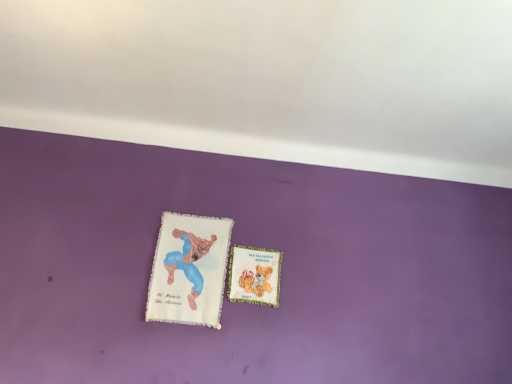
Identify the location of white fabric book at center, the second paperback book viewed from the right. The width and height of the screenshot is (512, 384). (189, 270).

The image size is (512, 384). Describe the element at coordinates (189, 270) in the screenshot. I see `white fabric book at center, the 1th paperback book in the left-to-right sequence` at that location.

This screenshot has width=512, height=384. What do you see at coordinates (254, 275) in the screenshot?
I see `pastel green fabric bookmark at center, marked as the 1th paperback book in a right-to-left arrangement` at bounding box center [254, 275].

Locate an element on the screen. pastel green fabric bookmark at center, marked as the 1th paperback book in a right-to-left arrangement is located at coordinates (254, 275).

In order to face pastel green fabric bookmark at center, marked as the 1th paperback book in a right-to-left arrangement, should I rotate leftwards or rightwards?

Turn right approximately 0.350 degrees to face it.

This screenshot has height=384, width=512. In order to click on white fabric book at center, the 1th paperback book in the left-to-right sequence in this screenshot , I will do `click(189, 270)`.

Would you say pastel green fabric bookmark at center, which is counted as the 2th paperback book, starting from the left, is to the left or to the right of white fabric book at center, the 1th paperback book in the left-to-right sequence, in the picture?

From the image, it's evident that pastel green fabric bookmark at center, which is counted as the 2th paperback book, starting from the left, is to the right of white fabric book at center, the 1th paperback book in the left-to-right sequence.

Is pastel green fabric bookmark at center, which is counted as the 2th paperback book, starting from the left, further to camera compared to white fabric book at center, the second paperback book viewed from the right?

Yes.

Is point (262, 281) more distant than point (216, 301)?

Yes, it is behind point (216, 301).

From the image's perspective, is pastel green fabric bookmark at center, marked as the 1th paperback book in a right-to-left arrangement, located above or below white fabric book at center, the second paperback book viewed from the right?

From the image's perspective, pastel green fabric bookmark at center, marked as the 1th paperback book in a right-to-left arrangement, appears below white fabric book at center, the second paperback book viewed from the right.

From a real-world perspective, is pastel green fabric bookmark at center, marked as the 1th paperback book in a right-to-left arrangement, physically below white fabric book at center, the 1th paperback book in the left-to-right sequence?

No, from a real-world perspective, pastel green fabric bookmark at center, marked as the 1th paperback book in a right-to-left arrangement, is not under white fabric book at center, the 1th paperback book in the left-to-right sequence.

Considering the relative sizes of pastel green fabric bookmark at center, marked as the 1th paperback book in a right-to-left arrangement, and white fabric book at center, the second paperback book viewed from the right, in the image provided, is pastel green fabric bookmark at center, marked as the 1th paperback book in a right-to-left arrangement, wider than white fabric book at center, the second paperback book viewed from the right,?

No.

Consider the image. Between pastel green fabric bookmark at center, which is counted as the 2th paperback book, starting from the left, and white fabric book at center, the second paperback book viewed from the right, which one has less height?

With less height is pastel green fabric bookmark at center, which is counted as the 2th paperback book, starting from the left.

Can you confirm if pastel green fabric bookmark at center, marked as the 1th paperback book in a right-to-left arrangement, is bigger than white fabric book at center, the 1th paperback book in the left-to-right sequence?

No, pastel green fabric bookmark at center, marked as the 1th paperback book in a right-to-left arrangement, is not bigger than white fabric book at center, the 1th paperback book in the left-to-right sequence.

Is pastel green fabric bookmark at center, which is counted as the 2th paperback book, starting from the left, situated inside white fabric book at center, the second paperback book viewed from the right, or outside?

pastel green fabric bookmark at center, which is counted as the 2th paperback book, starting from the left, is spatially situated outside white fabric book at center, the second paperback book viewed from the right.

Is pastel green fabric bookmark at center, which is counted as the 2th paperback book, starting from the left, not close to white fabric book at center, the 1th paperback book in the left-to-right sequence?

No, pastel green fabric bookmark at center, which is counted as the 2th paperback book, starting from the left, is not far away from white fabric book at center, the 1th paperback book in the left-to-right sequence.

From the picture: Is pastel green fabric bookmark at center, which is counted as the 2th paperback book, starting from the left, facing towards white fabric book at center, the second paperback book viewed from the right?

No, pastel green fabric bookmark at center, which is counted as the 2th paperback book, starting from the left, does not turn towards white fabric book at center, the second paperback book viewed from the right.

How many degrees apart are the facing directions of pastel green fabric bookmark at center, marked as the 1th paperback book in a right-to-left arrangement, and white fabric book at center, the 1th paperback book in the left-to-right sequence?

They differ by 0.191 degrees in their facing directions.

Could you measure the distance between pastel green fabric bookmark at center, which is counted as the 2th paperback book, starting from the left, and white fabric book at center, the second paperback book viewed from the right?

pastel green fabric bookmark at center, which is counted as the 2th paperback book, starting from the left, and white fabric book at center, the second paperback book viewed from the right, are 7.82 inches apart.

Identify the location of paperback book above the pastel green fabric bookmark at center, marked as the 1th paperback book in a right-to-left arrangement (from the image's perspective). (189, 270).

Between white fabric book at center, the 1th paperback book in the left-to-right sequence, and pastel green fabric bookmark at center, which is counted as the 2th paperback book, starting from the left, which one appears on the left side from the viewer's perspective?

white fabric book at center, the 1th paperback book in the left-to-right sequence, is more to the left.

Relative to pastel green fabric bookmark at center, marked as the 1th paperback book in a right-to-left arrangement, is white fabric book at center, the second paperback book viewed from the right, in front or behind?

white fabric book at center, the second paperback book viewed from the right, is in front of pastel green fabric bookmark at center, marked as the 1th paperback book in a right-to-left arrangement.

Considering the points (182, 217) and (236, 251), which point is behind, point (182, 217) or point (236, 251)?

The point (182, 217) is farther.

From the image's perspective, which one is positioned higher, white fabric book at center, the 1th paperback book in the left-to-right sequence, or pastel green fabric bookmark at center, marked as the 1th paperback book in a right-to-left arrangement?

white fabric book at center, the 1th paperback book in the left-to-right sequence, appears higher in the image.

From a real-world perspective, is white fabric book at center, the 1th paperback book in the left-to-right sequence, positioned over pastel green fabric bookmark at center, marked as the 1th paperback book in a right-to-left arrangement, based on gravity?

Incorrect, from a real-world perspective, white fabric book at center, the 1th paperback book in the left-to-right sequence, is lower than pastel green fabric bookmark at center, marked as the 1th paperback book in a right-to-left arrangement.

Considering the relative sizes of white fabric book at center, the 1th paperback book in the left-to-right sequence, and pastel green fabric bookmark at center, marked as the 1th paperback book in a right-to-left arrangement, in the image provided, is white fabric book at center, the 1th paperback book in the left-to-right sequence, thinner than pastel green fabric bookmark at center, marked as the 1th paperback book in a right-to-left arrangement,?

No, white fabric book at center, the 1th paperback book in the left-to-right sequence, is not thinner than pastel green fabric bookmark at center, marked as the 1th paperback book in a right-to-left arrangement.

Does white fabric book at center, the second paperback book viewed from the right, have a lesser height compared to pastel green fabric bookmark at center, marked as the 1th paperback book in a right-to-left arrangement?

In fact, white fabric book at center, the second paperback book viewed from the right, may be taller than pastel green fabric bookmark at center, marked as the 1th paperback book in a right-to-left arrangement.

Considering the relative sizes of white fabric book at center, the second paperback book viewed from the right, and pastel green fabric bookmark at center, which is counted as the 2th paperback book, starting from the left, in the image provided, is white fabric book at center, the second paperback book viewed from the right, bigger than pastel green fabric bookmark at center, which is counted as the 2th paperback book, starting from the left,?

Yes, white fabric book at center, the second paperback book viewed from the right, is bigger than pastel green fabric bookmark at center, which is counted as the 2th paperback book, starting from the left.

In the scene shown: Choose the correct answer: Is white fabric book at center, the 1th paperback book in the left-to-right sequence, inside pastel green fabric bookmark at center, marked as the 1th paperback book in a right-to-left arrangement, or outside it?

white fabric book at center, the 1th paperback book in the left-to-right sequence, exists outside the volume of pastel green fabric bookmark at center, marked as the 1th paperback book in a right-to-left arrangement.

Is white fabric book at center, the second paperback book viewed from the right, with pastel green fabric bookmark at center, which is counted as the 2th paperback book, starting from the left?

There is a gap between white fabric book at center, the second paperback book viewed from the right, and pastel green fabric bookmark at center, which is counted as the 2th paperback book, starting from the left.

Is pastel green fabric bookmark at center, marked as the 1th paperback book in a right-to-left arrangement, at the back of white fabric book at center, the 1th paperback book in the left-to-right sequence?

No, pastel green fabric bookmark at center, marked as the 1th paperback book in a right-to-left arrangement, is not at the back of white fabric book at center, the 1th paperback book in the left-to-right sequence.

In the image, there is a pastel green fabric bookmark at center, marked as the 1th paperback book in a right-to-left arrangement. Identify the location of paperback book above it (from the image's perspective). (189, 270).

You are a GUI agent. You are given a task and a screenshot of the screen. Output one action in this format:
    pyautogui.click(x=<x>, y=<y>)
    Task: Click on the paperback book directly beneath the pastel green fabric bookmark at center, marked as the 1th paperback book in a right-to-left arrangement (from a real-world perspective)
    This screenshot has width=512, height=384.
    Given the screenshot: What is the action you would take?
    pyautogui.click(x=189, y=270)

The height and width of the screenshot is (384, 512). I want to click on paperback book on the left of pastel green fabric bookmark at center, which is counted as the 2th paperback book, starting from the left, so click(189, 270).